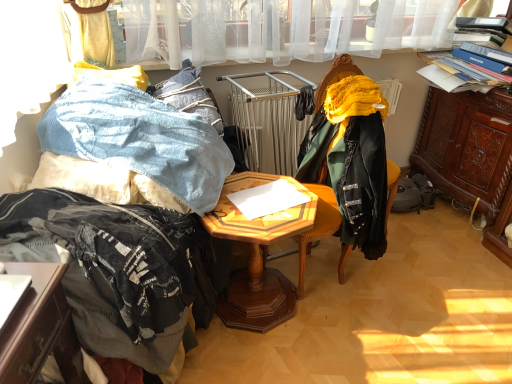
The image size is (512, 384). What are the coordinates of `free location to the right of velvet green chair at center` in the screenshot? It's located at (384, 298).